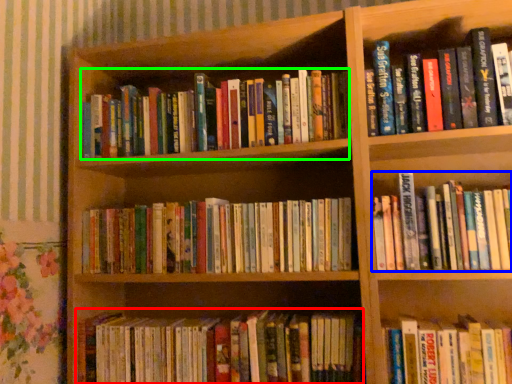
Question: Which object is the farthest from book (highlighted by a red box)? Choose among these: book (highlighted by a blue box) or book (highlighted by a green box).

Choices:
 (A) book
 (B) book

Answer: (B)